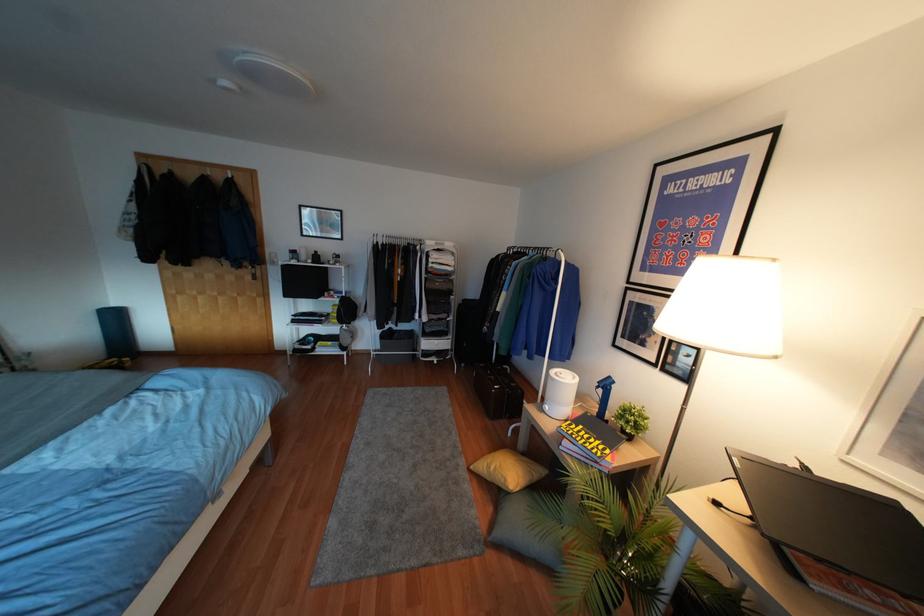
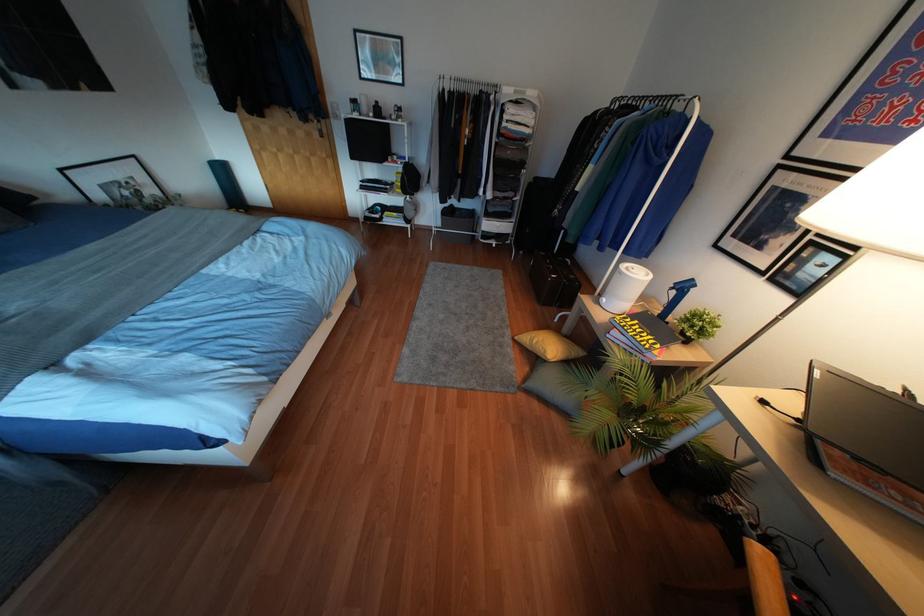
In the second image, find the point that corresponds to [585,565] in the first image.

(600, 416)